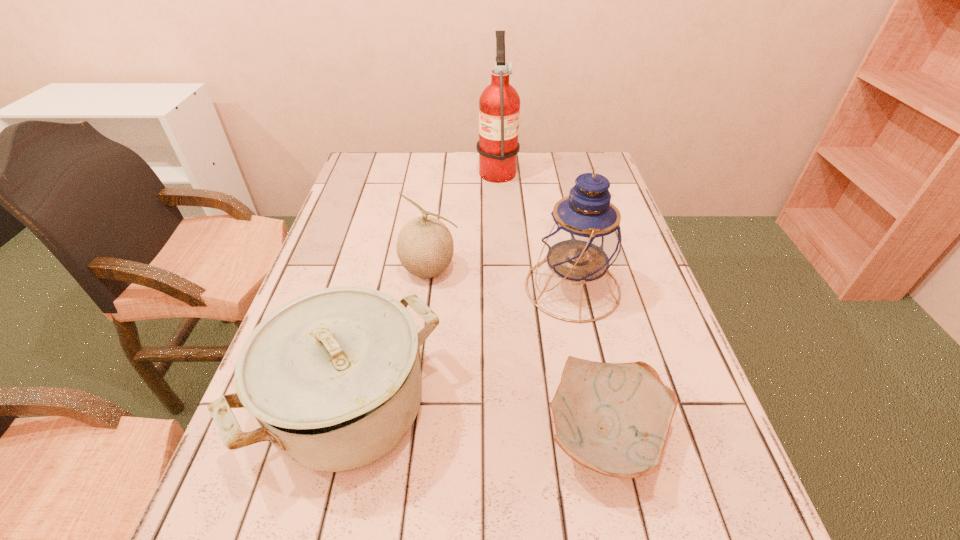
Find the location of `empty space that is in between the shortest object and the farthest object`. empty space that is in between the shortest object and the farthest object is located at coordinates (551, 302).

The width and height of the screenshot is (960, 540). What are the coordinates of `free space between the farthest object and the cantaloup` in the screenshot? It's located at (464, 219).

The width and height of the screenshot is (960, 540). I want to click on the fourth closest object to the saucepan, so click(499, 104).

Identify which object is the closest to the shortest object. Please provide its 2D coordinates. Your answer should be formatted as a tuple, i.e. [(x, y)], where the tuple contains the x and y coordinates of a point satisfying the conditions above.

[(582, 239)]

In order to click on vacant region that satisfies the following two spatial constraints: 1. on the front-facing side of the shortest object; 2. on the right side of the lantern in this screenshot , I will do `click(605, 435)`.

Find the location of `vacant region that satisfies the following two spatial constraints: 1. on the front-facing side of the lantern; 2. on the front side of the saucepan`. vacant region that satisfies the following two spatial constraints: 1. on the front-facing side of the lantern; 2. on the front side of the saucepan is located at coordinates (598, 407).

Where is `vacant position in the image that satisfies the following two spatial constraints: 1. on the front-facing side of the shortest object; 2. on the left side of the second tallest object`? The height and width of the screenshot is (540, 960). vacant position in the image that satisfies the following two spatial constraints: 1. on the front-facing side of the shortest object; 2. on the left side of the second tallest object is located at coordinates (605, 435).